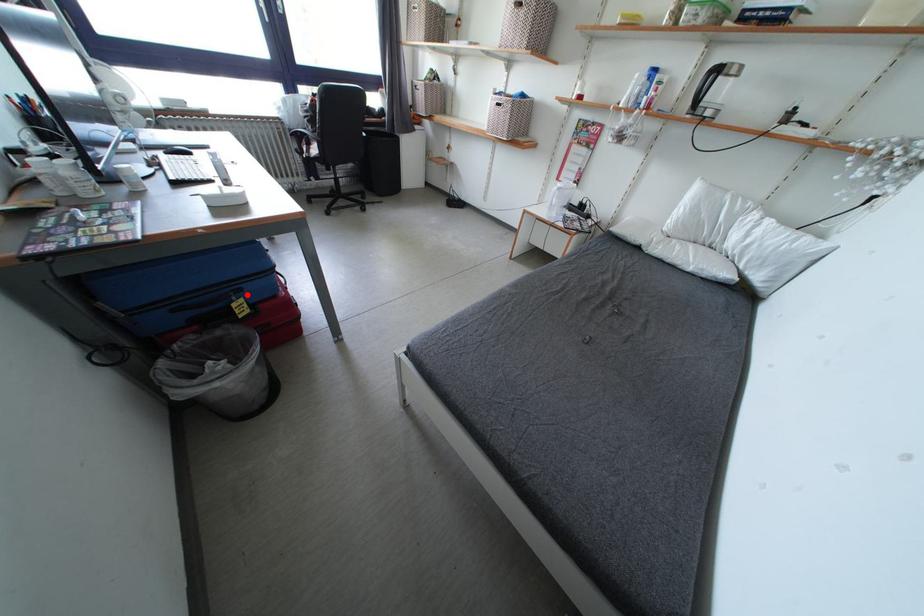
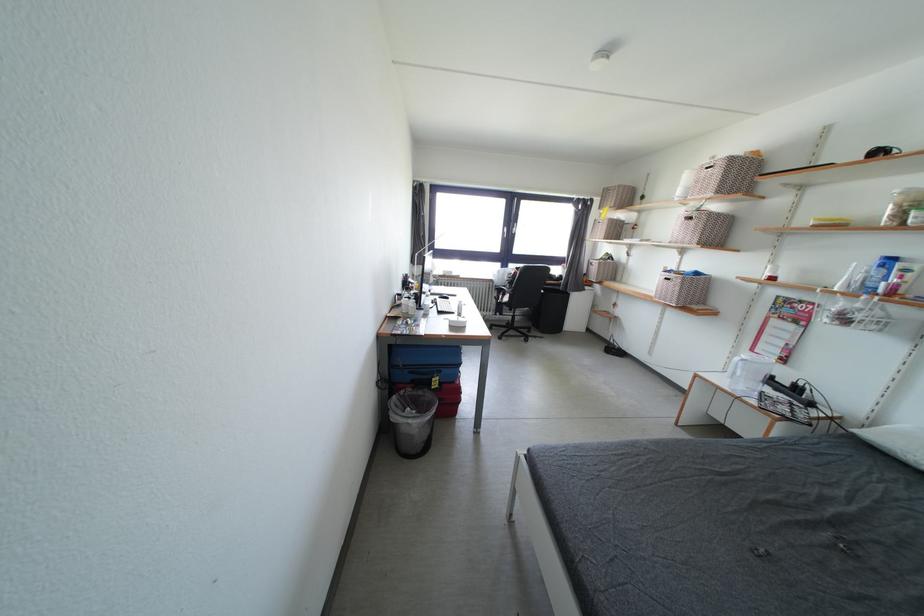
Where in the second image is the point corresponding to the highlighted location from the first image?

(446, 377)